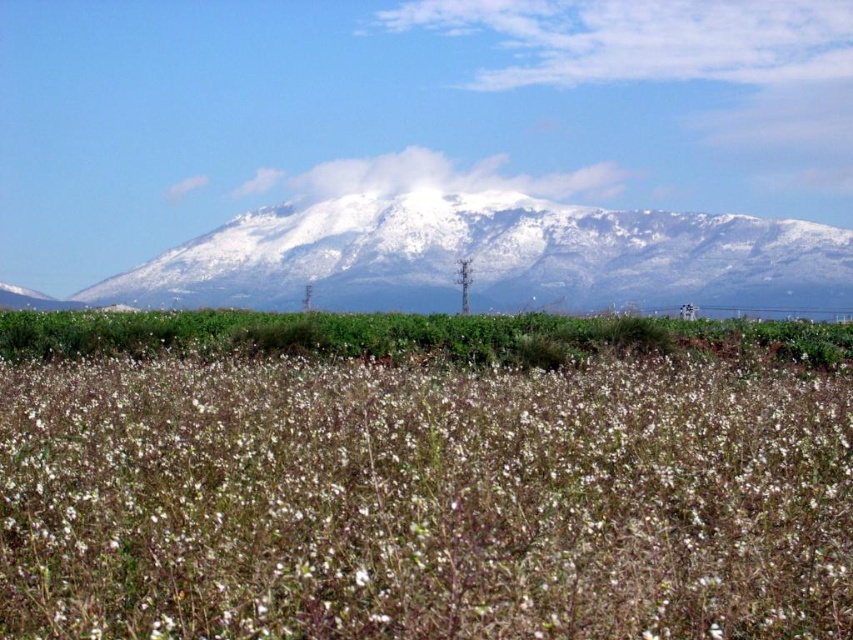
Question: Which point appears closest to the camera in this image?

Choices:
 (A) (624, 337)
 (B) (607, 296)

Answer: (A)

Question: Does white snow-covered mountain at center have a smaller size compared to green leafy grass at center?

Choices:
 (A) yes
 (B) no

Answer: (B)

Question: Where is white fluffy plant at center located in relation to white snow-covered mountain at center in the image?

Choices:
 (A) below
 (B) above

Answer: (A)

Question: Which object appears farthest from the camera in this image?

Choices:
 (A) white fluffy plant at center
 (B) white snow-covered mountain at center

Answer: (B)

Question: Observing the image, what is the correct spatial positioning of white snow-covered mountain at center in reference to green leafy grass at center?

Choices:
 (A) above
 (B) below

Answer: (A)

Question: Which point appears farthest from the camera in this image?

Choices:
 (A) (683, 323)
 (B) (756, 273)
 (C) (572, 529)

Answer: (B)